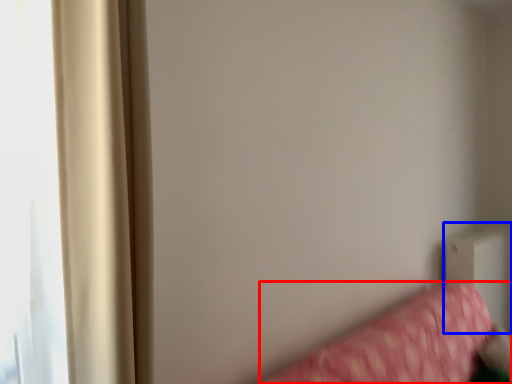
Question: Which of the following is the farthest to the observer, furniture (highlighted by a red box) or radiator (highlighted by a blue box)?

Choices:
 (A) furniture
 (B) radiator

Answer: (B)